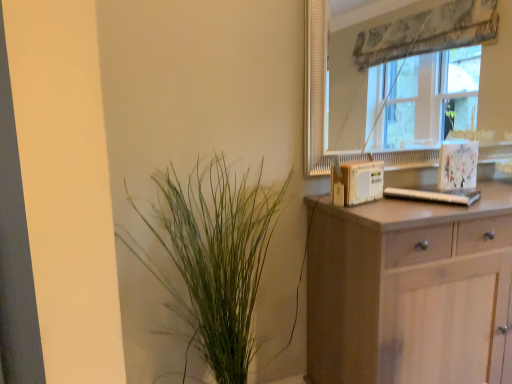
Question: Is light brown wooden chest of drawers at right looking in the opposite direction of green leafy plant at left?

Choices:
 (A) yes
 (B) no

Answer: (B)

Question: Can you confirm if light brown wooden chest of drawers at right is shorter than green leafy plant at left?

Choices:
 (A) yes
 (B) no

Answer: (A)

Question: From the image's perspective, does light brown wooden chest of drawers at right appear lower than green leafy plant at left?

Choices:
 (A) yes
 (B) no

Answer: (A)

Question: Is light brown wooden chest of drawers at right thinner than green leafy plant at left?

Choices:
 (A) no
 (B) yes

Answer: (A)

Question: Is light brown wooden chest of drawers at right completely or partially outside of green leafy plant at left?

Choices:
 (A) yes
 (B) no

Answer: (A)

Question: From the image's perspective, is transparent glass window at upper right positioned above or below light brown wooden chest of drawers at right?

Choices:
 (A) above
 (B) below

Answer: (A)

Question: Looking at the image, does transparent glass window at upper right seem bigger or smaller compared to light brown wooden chest of drawers at right?

Choices:
 (A) small
 (B) big

Answer: (A)

Question: Visually, is transparent glass window at upper right positioned to the left or to the right of light brown wooden chest of drawers at right?

Choices:
 (A) right
 (B) left

Answer: (B)

Question: Does point (438, 8) appear closer or farther from the camera than point (313, 342)?

Choices:
 (A) farther
 (B) closer

Answer: (A)

Question: Which is correct: light brown wooden chest of drawers at right is inside green leafy plant at left, or outside of it?

Choices:
 (A) inside
 (B) outside

Answer: (B)

Question: Considering their positions, is light brown wooden chest of drawers at right located in front of or behind green leafy plant at left?

Choices:
 (A) behind
 (B) front

Answer: (A)

Question: Based on their positions, is light brown wooden chest of drawers at right located to the left or right of green leafy plant at left?

Choices:
 (A) right
 (B) left

Answer: (A)

Question: From their relative heights in the image, would you say light brown wooden chest of drawers at right is taller or shorter than green leafy plant at left?

Choices:
 (A) tall
 (B) short

Answer: (B)

Question: From the image's perspective, is light brown wooden chest of drawers at right above or below transparent glass window at upper right?

Choices:
 (A) above
 (B) below

Answer: (B)

Question: Is light brown wooden chest of drawers at right situated inside transparent glass window at upper right or outside?

Choices:
 (A) inside
 (B) outside

Answer: (B)